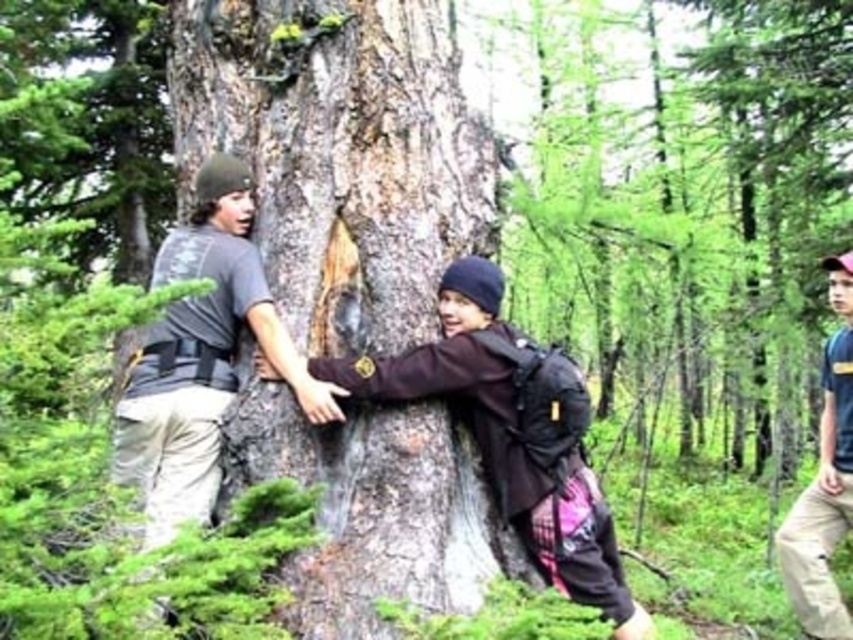
Is smooth bark tree trunk at center thinner than gray t-shirt at left?

In fact, smooth bark tree trunk at center might be wider than gray t-shirt at left.

The width and height of the screenshot is (853, 640). What do you see at coordinates (340, 154) in the screenshot? I see `smooth bark tree trunk at center` at bounding box center [340, 154].

Locate an element on the screen. This screenshot has height=640, width=853. smooth bark tree trunk at center is located at coordinates (340, 154).

Can you confirm if smooth bark tree trunk at center is positioned to the right of blue cotton shirt at right?

In fact, smooth bark tree trunk at center is to the left of blue cotton shirt at right.

Does smooth bark tree trunk at center have a lesser width compared to blue cotton shirt at right?

No.

Which is in front, point (363, 406) or point (836, 445)?

Point (363, 406)

You are a GUI agent. You are given a task and a screenshot of the screen. Output one action in this format:
    pyautogui.click(x=<x>, y=<y>)
    Task: Click on the smooth bark tree trunk at center
    This screenshot has height=640, width=853.
    Given the screenshot: What is the action you would take?
    pyautogui.click(x=340, y=154)

The height and width of the screenshot is (640, 853). What do you see at coordinates (202, 356) in the screenshot? I see `gray t-shirt at left` at bounding box center [202, 356].

Who is more distant from viewer, (196, 480) or (543, 484)?

The point (543, 484) is more distant.

Locate an element on the screen. This screenshot has height=640, width=853. gray t-shirt at left is located at coordinates (202, 356).

Where is `gray t-shirt at left`? gray t-shirt at left is located at coordinates (202, 356).